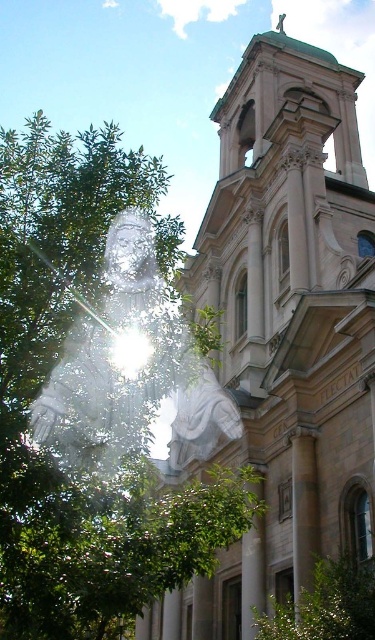
Question: Does white marble church at center have a greater width compared to white marble statue at center?

Choices:
 (A) yes
 (B) no

Answer: (A)

Question: Does white marble church at center have a smaller size compared to white marble statue at center?

Choices:
 (A) no
 (B) yes

Answer: (A)

Question: Which object appears closest to the camera in this image?

Choices:
 (A) white marble church at center
 (B) green leafy tree at left
 (C) white marble statue at center

Answer: (B)

Question: Does white marble church at center appear over white marble statue at center?

Choices:
 (A) no
 (B) yes

Answer: (B)

Question: Among these points, which one is farthest from the camera?

Choices:
 (A) (262, 189)
 (B) (237, 436)
 (C) (31, 296)

Answer: (A)

Question: Which of the following is the closest to the observer?

Choices:
 (A) click(x=148, y=337)
 (B) click(x=139, y=198)

Answer: (A)